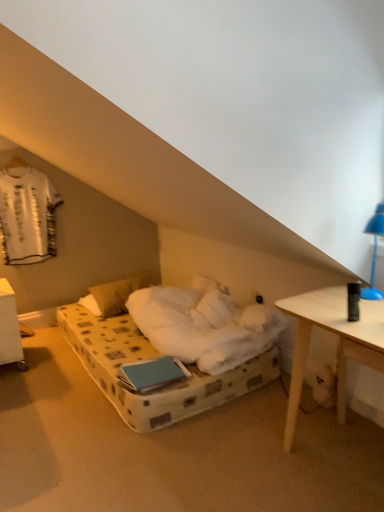
The width and height of the screenshot is (384, 512). Identify the location of free space to the right of white plastic nightstand at lower left. (51, 359).